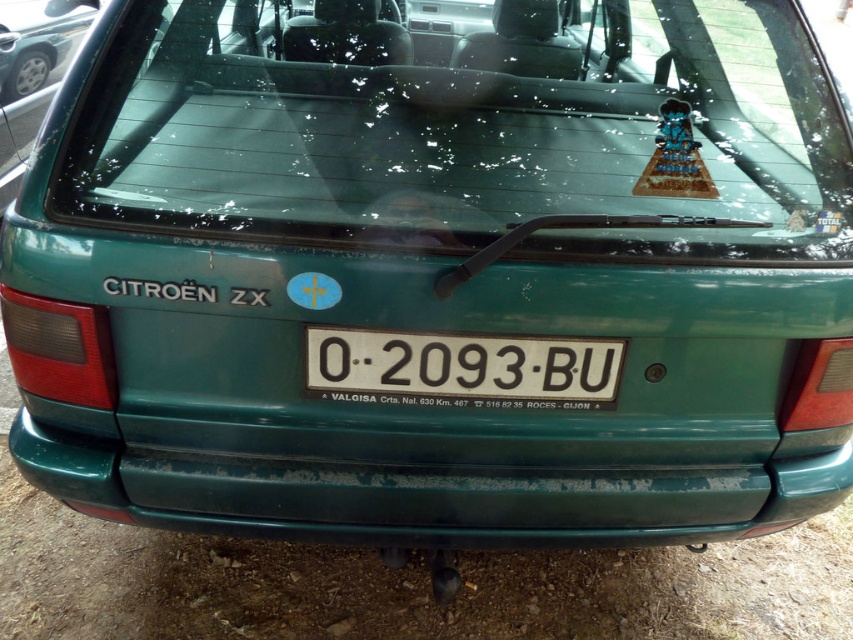
Question: Which point is farther from the camera taking this photo?

Choices:
 (A) (270, 56)
 (B) (103, 506)
 (C) (477, 344)
 (D) (36, 48)

Answer: (D)

Question: Does transparent glass windshield at upper center appear under green matte car at upper center?

Choices:
 (A) no
 (B) yes

Answer: (B)

Question: Does green matte bumper at lower center come in front of green matte car at upper center?

Choices:
 (A) no
 (B) yes

Answer: (B)

Question: Which of these objects is positioned farthest from the transparent glass windshield at upper center?

Choices:
 (A) white plastic license plate at center
 (B) green matte bumper at lower center
 (C) green matte car at upper center

Answer: (C)

Question: Which object appears farthest from the camera in this image?

Choices:
 (A) green matte car at upper center
 (B) green matte bumper at lower center

Answer: (A)

Question: Does transparent glass windshield at upper center appear under green matte car at upper center?

Choices:
 (A) no
 (B) yes

Answer: (B)